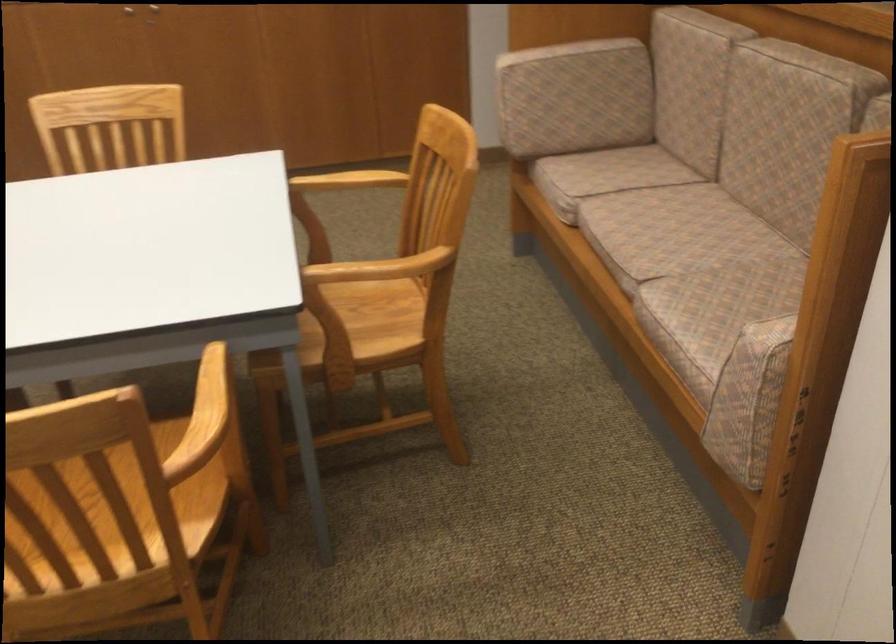
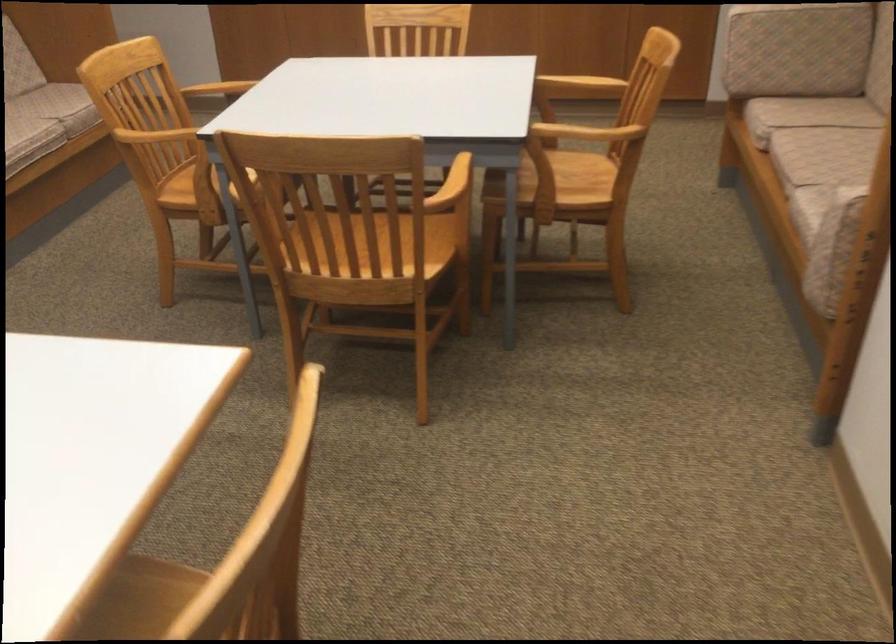
Locate, in the second image, the point that corresponds to point (236, 393) in the first image.

(470, 174)